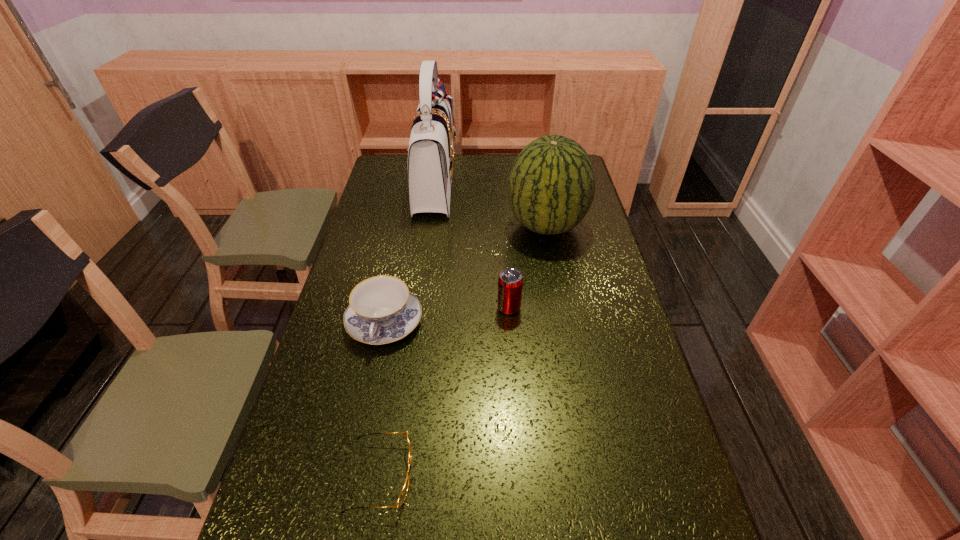
Locate an element on the screen. The width and height of the screenshot is (960, 540). free space located on the front-facing side of the shortest object is located at coordinates (558, 475).

Identify the location of object present at the far edge. The width and height of the screenshot is (960, 540). (431, 156).

The image size is (960, 540). Identify the location of satchel present at the left edge. (431, 156).

I want to click on chinaware located at the left edge, so click(x=382, y=310).

Locate an element on the screen. spectacles located at the left edge is located at coordinates (403, 493).

The image size is (960, 540). I want to click on object that is positioned at the right edge, so pyautogui.click(x=551, y=187).

Image resolution: width=960 pixels, height=540 pixels. I want to click on object that is at the far left corner, so click(x=431, y=156).

Identify the location of vacant space at the left edge. (355, 247).

Where is `vacant space at the right edge of the desktop`? vacant space at the right edge of the desktop is located at coordinates (647, 440).

The height and width of the screenshot is (540, 960). What are the coordinates of `blank space at the far left corner of the desktop` in the screenshot? It's located at (402, 170).